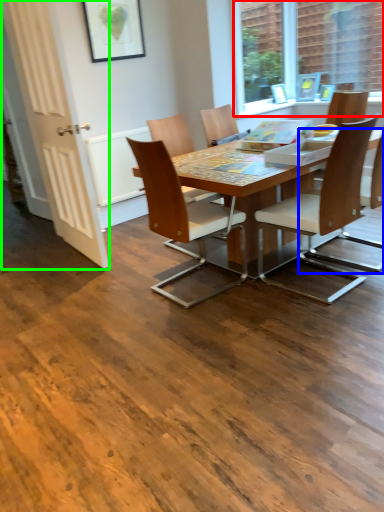
Question: Estimate the real-world distances between objects in this image. Which object is farther from window (highlighted by a red box), chair (highlighted by a blue box) or screen door (highlighted by a green box)?

Choices:
 (A) chair
 (B) screen door

Answer: (B)